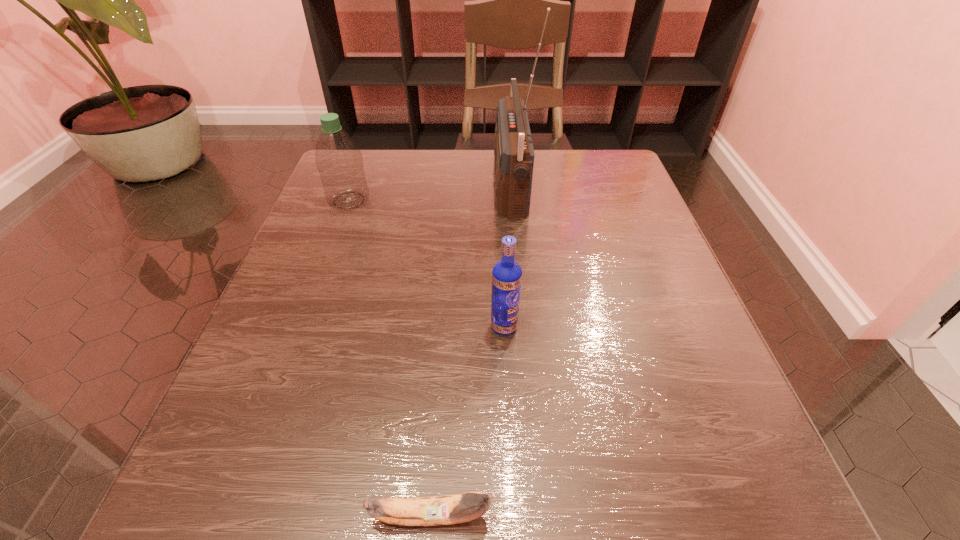
Find the location of a particular element. the tallest object is located at coordinates (514, 154).

Where is `the leftmost object`? The height and width of the screenshot is (540, 960). the leftmost object is located at coordinates (338, 158).

Where is `vodka`? This screenshot has height=540, width=960. vodka is located at coordinates (507, 274).

The height and width of the screenshot is (540, 960). I want to click on the nearest object, so (449, 509).

What are the coordinates of `the shortest object` in the screenshot? It's located at (449, 509).

This screenshot has width=960, height=540. I want to click on vacant region located 0.240m on the front-facing side of the tallest object, so click(390, 186).

This screenshot has height=540, width=960. In order to click on vacant region located 0.220m on the front-facing side of the tallest object in this screenshot , I will do `click(398, 186)`.

This screenshot has height=540, width=960. Identify the location of vacant region located on the front-facing side of the tallest object. (377, 186).

Where is `blank space located 0.080m on the back of the leftmost object`? The width and height of the screenshot is (960, 540). blank space located 0.080m on the back of the leftmost object is located at coordinates (360, 171).

Identify the location of blank space located 0.080m on the front of the third farthest object. (507, 381).